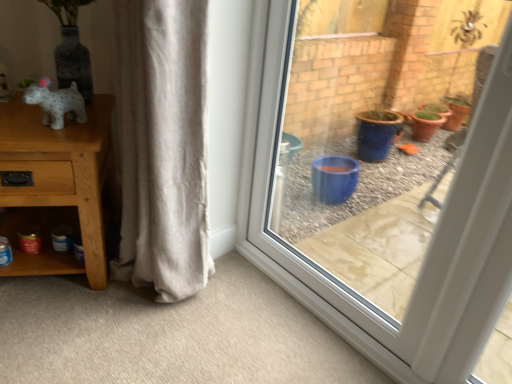
Locate an element on the screen. transparent glass window at center is located at coordinates pos(431,242).

The height and width of the screenshot is (384, 512). In order to click on speckled white dog at left in this screenshot , I will do `click(57, 104)`.

What is the approximate height of speckled white dog at left?

The height of speckled white dog at left is 6.63 inches.

Image resolution: width=512 pixels, height=384 pixels. What are the coordinates of `beige cotton curtain at center` in the screenshot? It's located at point(162,146).

Locate an element on the screen. transparent glass window at center is located at coordinates (431, 242).

Can you tell me how much wooden table at left and transparent glass window at center differ in facing direction?

wooden table at left and transparent glass window at center are facing 60 degrees away from each other.

Is wooden table at left in front of transparent glass window at center?

No, it is behind transparent glass window at center.

Considering the sizes of wooden table at left and transparent glass window at center in the image, is wooden table at left bigger or smaller than transparent glass window at center?

In the image, wooden table at left appears to be larger than transparent glass window at center.

Is transparent glass window at center far away from wooden table at left?

They are positioned close to each other.

Which of these two, transparent glass window at center or wooden table at left, stands shorter?

With less height is wooden table at left.

Could wooden table at left be considered to be inside transparent glass window at center?

No.

Is speckled white dog at left positioned beyond the bounds of transparent glass window at center?

Indeed, speckled white dog at left is completely outside transparent glass window at center.

Is speckled white dog at left turned away from transparent glass window at center?

No.

From a real-world perspective, is speckled white dog at left physically above transparent glass window at center?

Yes.

Can you tell me how much speckled white dog at left and transparent glass window at center differ in facing direction?

19.2 degrees separate the facing orientations of speckled white dog at left and transparent glass window at center.

What's the angular difference between transparent glass window at center and speckled white dog at left's facing directions?

The facing directions of transparent glass window at center and speckled white dog at left are 19.2 degrees apart.

Considering the relative sizes of transparent glass window at center and speckled white dog at left in the image provided, is transparent glass window at center wider than speckled white dog at left?

In fact, transparent glass window at center might be narrower than speckled white dog at left.

From the image's perspective, which is below, transparent glass window at center or speckled white dog at left?

transparent glass window at center, from the image's perspective.

Locate an element on the screen. This screenshot has height=384, width=512. furniture located on the left of speckled white dog at left is located at coordinates (57, 186).

Is speckled white dog at left surrounded by wooden table at left?

No, wooden table at left does not contain speckled white dog at left.

Is speckled white dog at left at the back of wooden table at left?

No.

Can you confirm if wooden table at left is wider than speckled white dog at left?

Indeed, wooden table at left has a greater width compared to speckled white dog at left.

Which is more to the left, beige cotton curtain at center or speckled white dog at left?

speckled white dog at left.

Considering the sizes of beige cotton curtain at center and speckled white dog at left in the image, is beige cotton curtain at center wider or thinner than speckled white dog at left?

Clearly, beige cotton curtain at center has more width compared to speckled white dog at left.

Between beige cotton curtain at center and speckled white dog at left, which one has more height?

beige cotton curtain at center.

From the image's perspective, which object appears higher, beige cotton curtain at center or speckled white dog at left?

speckled white dog at left, from the image's perspective.

Looking at this image, which of these two, speckled white dog at left or wooden table at left, is smaller?

Smaller between the two is speckled white dog at left.

Is point (75, 92) behind point (35, 205)?

Yes.

Which is correct: speckled white dog at left is inside wooden table at left, or outside of it?

The correct answer is: outside.

The height and width of the screenshot is (384, 512). I want to click on furniture below the transparent glass window at center (from the image's perspective), so click(57, 186).

Find the location of a particular element. Image resolution: width=512 pixels, height=384 pixels. furniture located on the left of transparent glass window at center is located at coordinates (57, 186).

Estimate the real-world distances between objects in this image. Which object is closer to wooden table at left, beige cotton curtain at center or speckled white dog at left?

speckled white dog at left is positioned closer to the anchor wooden table at left.

Looking at the image, which one is located further to wooden table at left, beige cotton curtain at center or transparent glass window at center?

transparent glass window at center.

When comparing their distances from speckled white dog at left, does transparent glass window at center or wooden table at left seem closer?

Based on the image, wooden table at left appears to be nearer to speckled white dog at left.

Which object lies nearer to the anchor point beige cotton curtain at center, transparent glass window at center or wooden table at left?

wooden table at left lies closer to beige cotton curtain at center than the other object.

In the scene shown: When comparing their distances from wooden table at left, does transparent glass window at center or beige cotton curtain at center seem closer?

beige cotton curtain at center lies closer to wooden table at left than the other object.

From the image, which object appears to be farther from transparent glass window at center, wooden table at left or beige cotton curtain at center?

wooden table at left lies further to transparent glass window at center than the other object.

In the scene shown: When comparing their distances from beige cotton curtain at center, does speckled white dog at left or wooden table at left seem further?

speckled white dog at left is positioned further to the anchor beige cotton curtain at center.

Estimate the real-world distances between objects in this image. Which object is further from beige cotton curtain at center, transparent glass window at center or speckled white dog at left?

transparent glass window at center.

The image size is (512, 384). Find the location of `animal situated between wooden table at left and beige cotton curtain at center from left to right`. animal situated between wooden table at left and beige cotton curtain at center from left to right is located at coordinates (57, 104).

Where is `animal situated between wooden table at left and transparent glass window at center from left to right`? animal situated between wooden table at left and transparent glass window at center from left to right is located at coordinates (57, 104).

You are a GUI agent. You are given a task and a screenshot of the screen. Output one action in this format:
    pyautogui.click(x=<x>, y=<y>)
    Task: Click on the curtain between wooden table at left and transparent glass window at center from left to right
    The image size is (512, 384).
    Given the screenshot: What is the action you would take?
    pyautogui.click(x=162, y=146)

This screenshot has width=512, height=384. Identify the location of curtain between speckled white dog at left and transparent glass window at center in the horizontal direction. (162, 146).